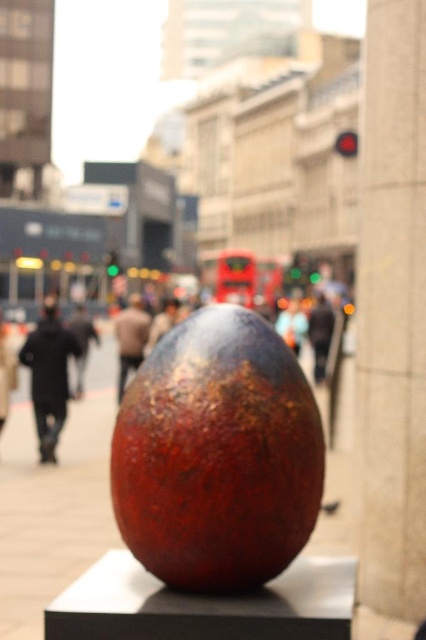
Is dark brown leather jacket at lower left to the right of brown leather jacket at center from the viewer's perspective?

Correct, you'll find dark brown leather jacket at lower left to the right of brown leather jacket at center.

Is point (55, 404) behind point (135, 369)?

No, it is not.

In order to click on dark brown leather jacket at lower left in this screenshot , I will do `click(48, 376)`.

Between dark brown leather jacket at lower left and dark brown leather jacket at center, which one has more height?

Standing taller between the two is dark brown leather jacket at center.

Who is more forward, [51,380] or [310,337]?

Point [51,380] is in front.

Find the location of a particular element. The image size is (426, 640). dark brown leather jacket at lower left is located at coordinates (48, 376).

Is point (109, 371) positioned after point (313, 342)?

Yes, point (109, 371) is farther from viewer.

Does point (8, 499) come in front of point (319, 344)?

Yes, point (8, 499) is closer to viewer.

Which is in front, point (20, 435) or point (319, 317)?

Point (20, 435)

At what (x,y) coordinates should I click in order to perform the action: click on shiny metallic sphere at center. Please return your answer as a coordinate pair (x, y). The width and height of the screenshot is (426, 640). Looking at the image, I should click on (54, 500).